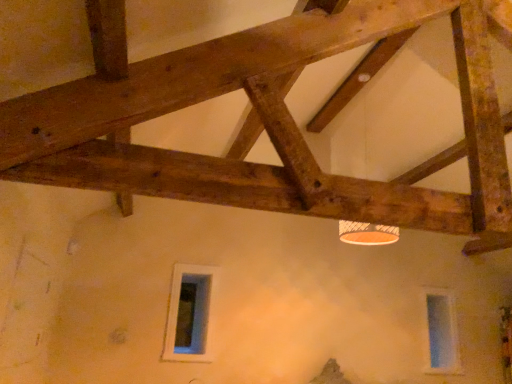
Question: Is transparent glass window at lower right, acting as the 1th window starting from the back, wider or thinner than white glass window at lower center, which ranks as the first window in left-to-right order?

Choices:
 (A) thin
 (B) wide

Answer: (B)

Question: Would you say transparent glass window at lower right, arranged as the second window when viewed from the front, is to the left or to the right of white glass window at lower center, arranged as the 1th window when viewed from the front, in the picture?

Choices:
 (A) left
 (B) right

Answer: (B)

Question: Which of these objects is positioned farthest from the white glass window at lower center, arranged as the 1th window when viewed from the front?

Choices:
 (A) transparent glass window at lower right, arranged as the second window when viewed from the front
 (B) orange matte lamp at upper center

Answer: (A)

Question: Based on their relative distances, which object is nearer to the white glass window at lower center, arranged as the 1th window when viewed from the front?

Choices:
 (A) orange matte lamp at upper center
 (B) transparent glass window at lower right, the 2th window viewed from the left

Answer: (A)